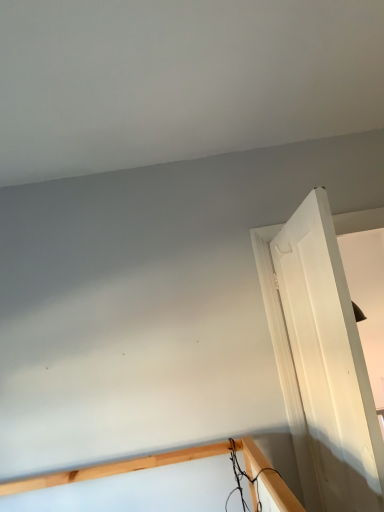
The image size is (384, 512). Describe the element at coordinates (323, 364) in the screenshot. I see `white matte door at right` at that location.

You are a GUI agent. You are given a task and a screenshot of the screen. Output one action in this format:
    pyautogui.click(x=<x>, y=<y>)
    Task: Click on the white matte door at right
    The height and width of the screenshot is (512, 384).
    Given the screenshot: What is the action you would take?
    pyautogui.click(x=323, y=364)

Locate an element on the screen. white matte door at right is located at coordinates (323, 364).